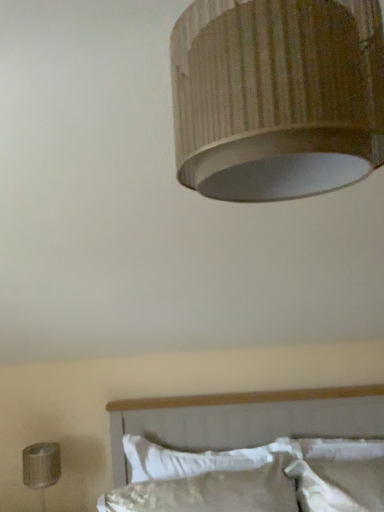
Question: In terms of width, does white soft pillow at lower center look wider or thinner when compared to metallic silver lamp at lower left, the first lamp positioned from the left?

Choices:
 (A) wide
 (B) thin

Answer: (B)

Question: Considering the positions of white soft pillow at lower center and metallic silver lamp at lower left, the first lamp positioned from the left, in the image, is white soft pillow at lower center bigger or smaller than metallic silver lamp at lower left, the first lamp positioned from the left,?

Choices:
 (A) small
 (B) big

Answer: (B)

Question: Which object is the closest to the metallic silver lamp at lower left, placed as the 2th lamp when sorted from right to left?

Choices:
 (A) white textured bed at lower center
 (B) wooden textured lampshade at upper center, positioned as the second lamp in bottom-to-top order
 (C) white soft pillow at lower center

Answer: (C)

Question: Which object is the farthest from the wooden textured lampshade at upper center, acting as the 2th lamp starting from the left?

Choices:
 (A) metallic silver lamp at lower left, arranged as the first lamp when viewed from the back
 (B) white soft pillow at lower center
 (C) white textured bed at lower center

Answer: (A)